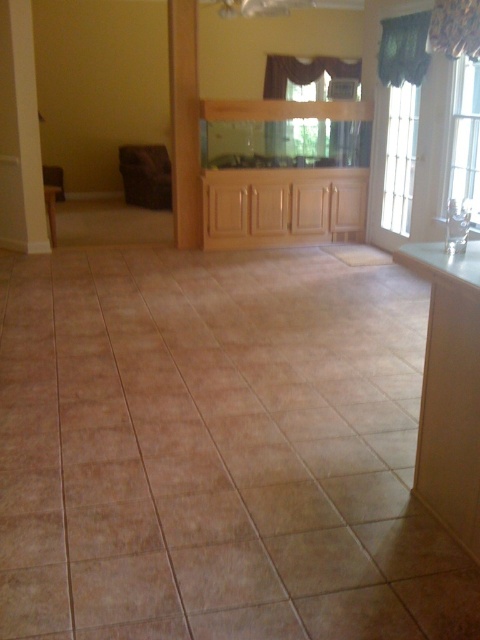
Question: Which point is closer to the camera?

Choices:
 (A) brown wood pillar at left
 (B) wooden pillar at center

Answer: (A)

Question: Can you confirm if brown wood pillar at left is positioned below wooden pillar at center?

Choices:
 (A) yes
 (B) no

Answer: (A)

Question: Which of the following is the closest to the observer?

Choices:
 (A) (192, 156)
 (B) (16, 92)

Answer: (B)

Question: Observing the image, what is the correct spatial positioning of brown wood pillar at left in reference to wooden pillar at center?

Choices:
 (A) above
 (B) below

Answer: (B)

Question: Can you confirm if brown wood pillar at left is thinner than wooden pillar at center?

Choices:
 (A) yes
 (B) no

Answer: (B)